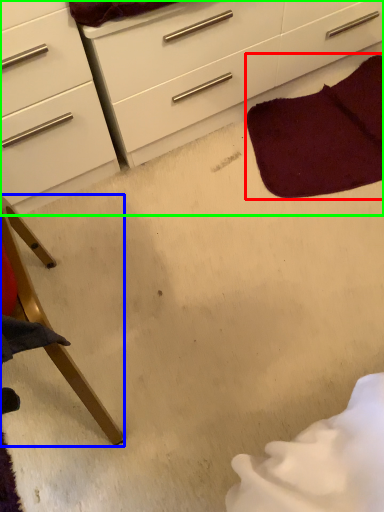
Question: Based on their relative distances, which object is farther from blanket (highlighted by a red box)? Choose from furniture (highlighted by a blue box) and chest of drawers (highlighted by a green box).

Choices:
 (A) furniture
 (B) chest of drawers

Answer: (A)